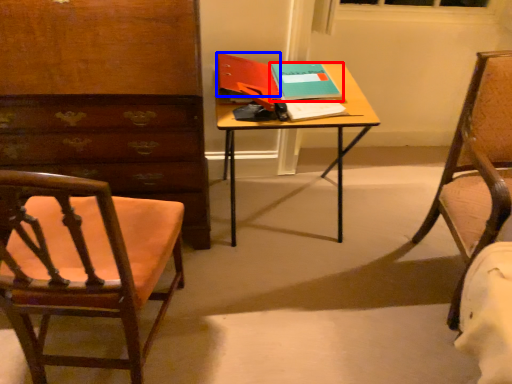
Question: Among these objects, which one is farthest to the camera, book (highlighted by a red box) or book (highlighted by a blue box)?

Choices:
 (A) book
 (B) book

Answer: (A)